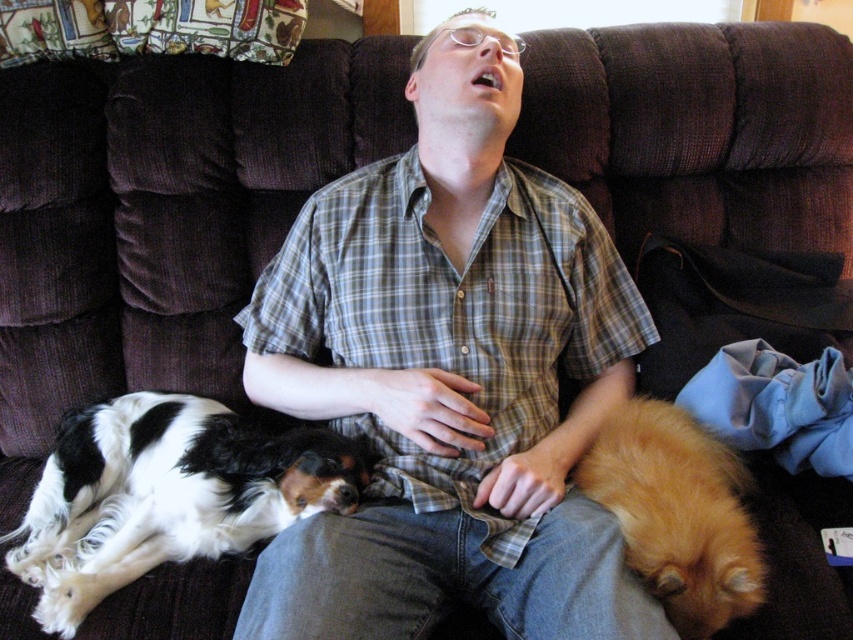
Does plaid shirt at center have a smaller size compared to fuzzy golden dog at lower right?

Actually, plaid shirt at center might be larger than fuzzy golden dog at lower right.

Who is higher up, plaid shirt at center or fuzzy golden dog at lower right?

plaid shirt at center

What are the coordinates of `plaid shirt at center` in the screenshot? It's located at (450, 376).

Is point (117, 582) positioned in front of point (730, 605)?

No, (117, 582) is further to viewer.

Is black and white fur at left shorter than fuzzy golden dog at lower right?

Incorrect, black and white fur at left's height does not fall short of fuzzy golden dog at lower right's.

The height and width of the screenshot is (640, 853). I want to click on black and white fur at left, so click(x=166, y=493).

I want to click on black and white fur at left, so click(166, 493).

Who is taller, plaid shirt at center or black and white fur at left?

plaid shirt at center

Does plaid shirt at center have a greater width compared to black and white fur at left?

Correct, the width of plaid shirt at center exceeds that of black and white fur at left.

Measure the distance between point (x=434, y=536) and camera.

Point (x=434, y=536) is 37.96 inches from camera.

Locate an element on the screen. Image resolution: width=853 pixels, height=640 pixels. plaid shirt at center is located at coordinates (450, 376).